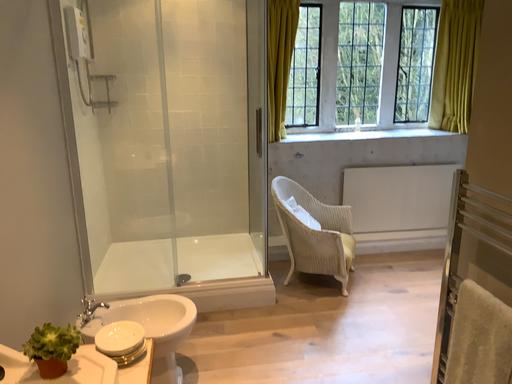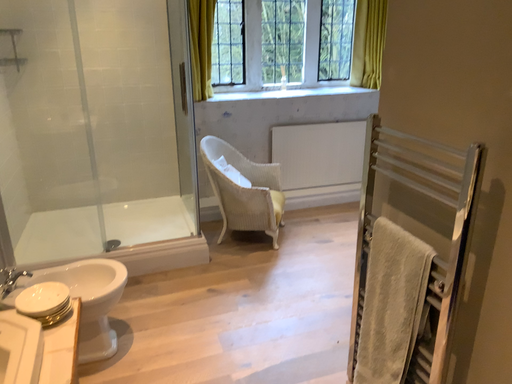
Question: Which way did the camera rotate in the video?

Choices:
 (A) rotated right
 (B) rotated left

Answer: (A)